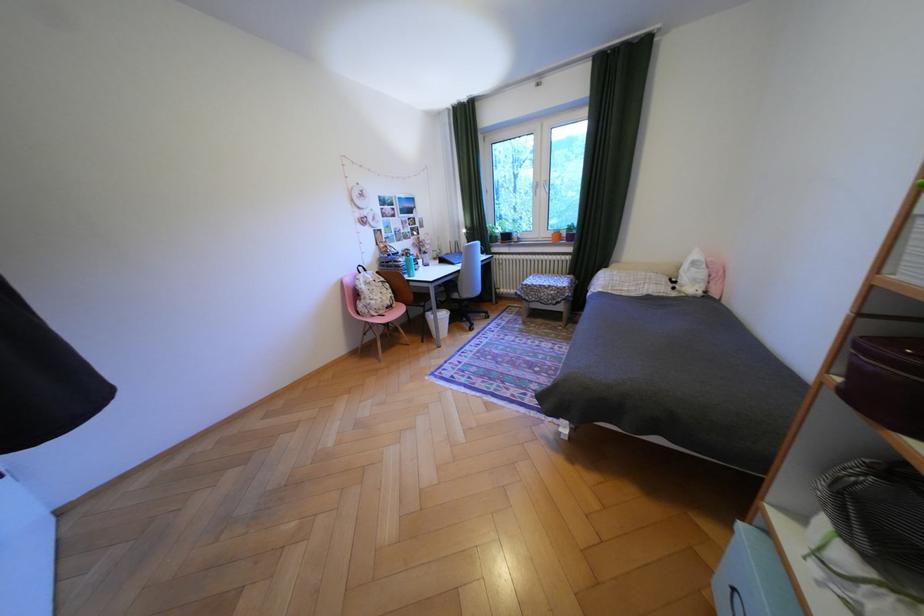
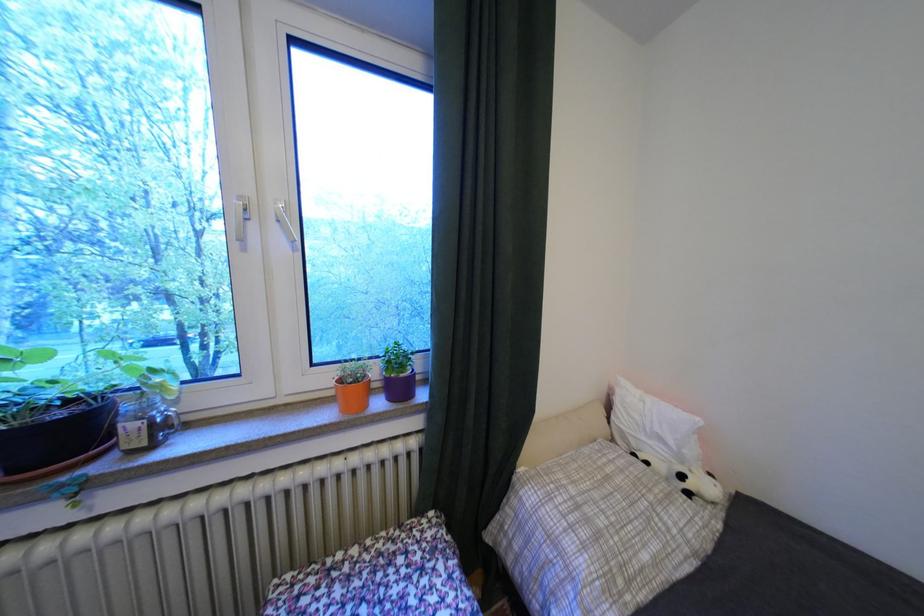
Locate, in the second image, the point that corresponds to pixel 639 291 in the first image.

(667, 562)